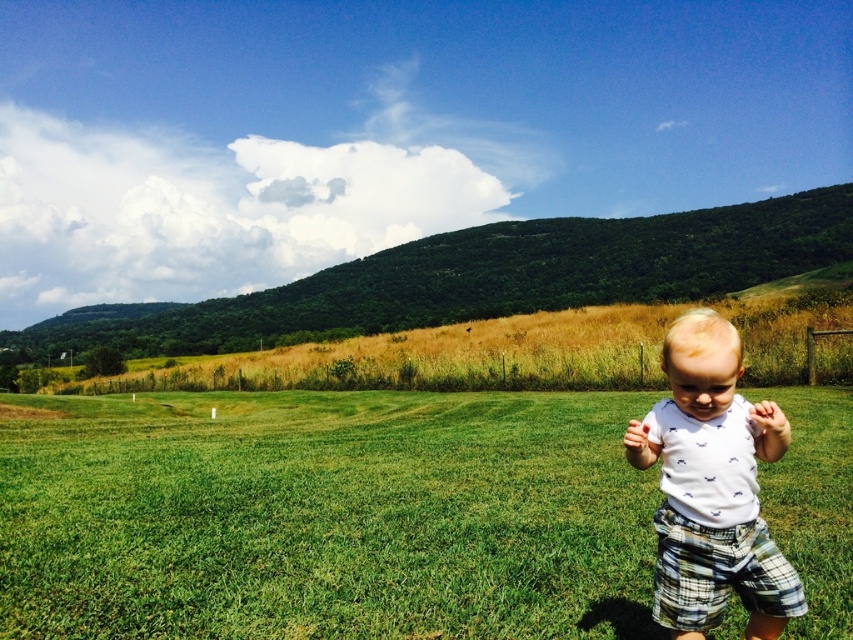
Question: Does green grass at center have a smaller size compared to white printed shirt at center?

Choices:
 (A) no
 (B) yes

Answer: (A)

Question: Can you confirm if green grass at center is positioned above white printed shirt at center?

Choices:
 (A) yes
 (B) no

Answer: (B)

Question: Which point appears farthest from the camera in this image?

Choices:
 (A) (764, 440)
 (B) (848, 493)

Answer: (B)

Question: Which object appears farthest from the camera in this image?

Choices:
 (A) white printed shirt at center
 (B) green grass at center

Answer: (B)

Question: Does green grass at center come behind white printed shirt at center?

Choices:
 (A) yes
 (B) no

Answer: (A)